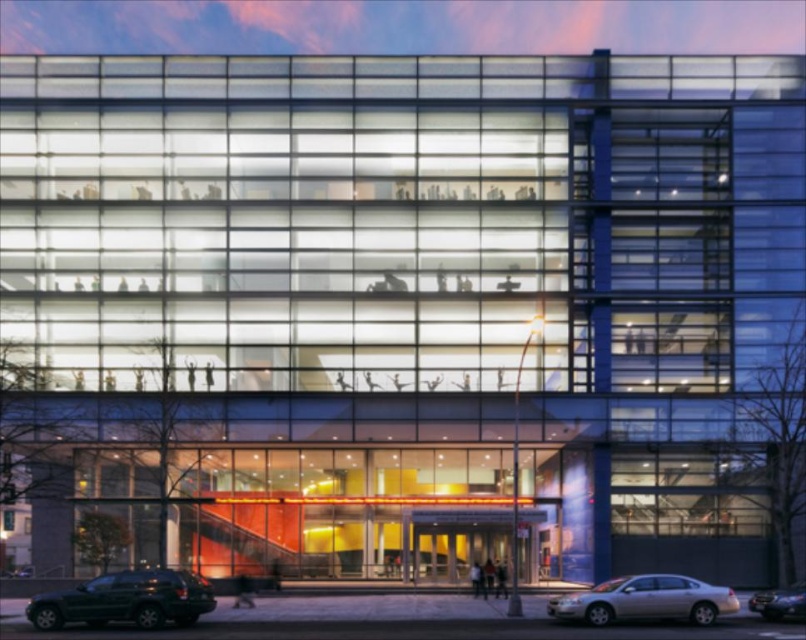
Does point (200, 593) lie in front of point (771, 592)?

Yes, it is.

Which is in front, point (143, 600) or point (786, 608)?

Point (143, 600) is in front.

You are a GUI agent. You are given a task and a screenshot of the screen. Output one action in this format:
    pyautogui.click(x=<x>, y=<y>)
    Task: Click on the shiny dark green suv at lower left
    The height and width of the screenshot is (640, 806).
    Given the screenshot: What is the action you would take?
    pyautogui.click(x=125, y=600)

Who is positioned more to the left, shiny dark green suv at lower left or silver metallic sedan at lower right?

shiny dark green suv at lower left

What do you see at coordinates (125, 600) in the screenshot? I see `shiny dark green suv at lower left` at bounding box center [125, 600].

You are a GUI agent. You are given a task and a screenshot of the screen. Output one action in this format:
    pyautogui.click(x=<x>, y=<y>)
    Task: Click on the shiny dark green suv at lower left
    The image size is (806, 640).
    Given the screenshot: What is the action you would take?
    pyautogui.click(x=125, y=600)

Who is taller, silver metallic sedan at lower right or shiny silver sedan at lower right?

Standing taller between the two is shiny silver sedan at lower right.

Who is more forward, (588, 593) or (771, 620)?

Point (588, 593)

In order to click on silver metallic sedan at lower right in this screenshot , I will do `click(646, 600)`.

I want to click on silver metallic sedan at lower right, so click(646, 600).